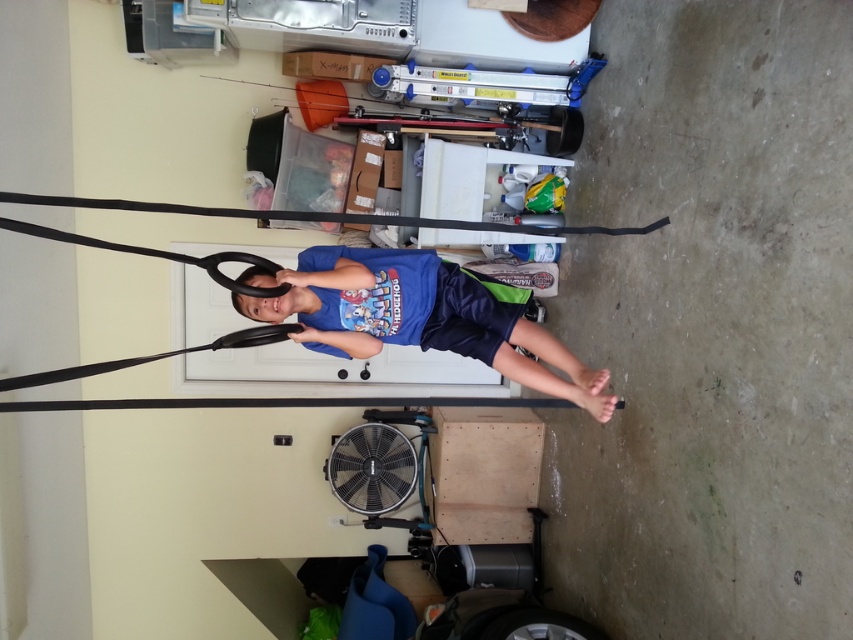
Question: Which object appears closest to the camera in this image?

Choices:
 (A) blue cotton shirt at center
 (B) black rubber tire at lower center

Answer: (A)

Question: Which object is closer to the camera taking this photo?

Choices:
 (A) blue cotton shirt at center
 (B) black rubber tire at lower center

Answer: (A)

Question: Can you confirm if blue cotton shirt at center is positioned below black rubber tire at lower center?

Choices:
 (A) no
 (B) yes

Answer: (A)

Question: Is blue cotton shirt at center wider than black rubber tire at lower center?

Choices:
 (A) no
 (B) yes

Answer: (B)

Question: Among these objects, which one is farthest from the camera?

Choices:
 (A) blue cotton shirt at center
 (B) black rubber tire at lower center

Answer: (B)

Question: Is blue cotton shirt at center closer to the viewer compared to black rubber tire at lower center?

Choices:
 (A) no
 (B) yes

Answer: (B)